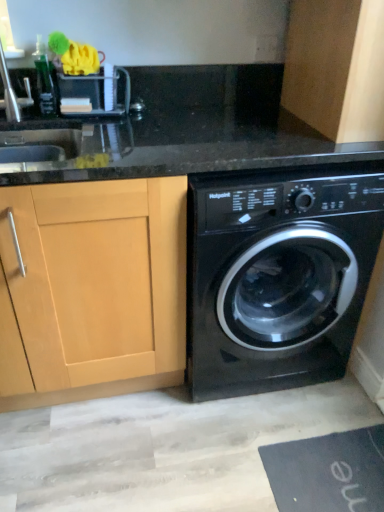
Question: Is black rubber bath mat at lower right placed right next to light wood cabinet at left, positioned as the 1th cabinetry in left-to-right order?

Choices:
 (A) yes
 (B) no

Answer: (B)

Question: Is black rubber bath mat at lower right bigger than light wood cabinet at left, the first cabinetry when ordered from bottom to top?

Choices:
 (A) no
 (B) yes

Answer: (A)

Question: Is the position of black rubber bath mat at lower right less distant than that of light wood cabinet at left, the second cabinetry in the right-to-left sequence?

Choices:
 (A) no
 (B) yes

Answer: (A)

Question: Is black rubber bath mat at lower right wider than light wood cabinet at left, the first cabinetry when ordered from bottom to top?

Choices:
 (A) no
 (B) yes

Answer: (A)

Question: Is black rubber bath mat at lower right further to camera compared to light wood cabinet at left, which appears as the 2th cabinetry when viewed from the top?

Choices:
 (A) no
 (B) yes

Answer: (B)

Question: Choose the correct answer: Is wooden cabinet at upper right, marked as the 2th cabinetry in a bottom-to-top arrangement, inside light wood cabinet at left, positioned as the 1th cabinetry in left-to-right order, or outside it?

Choices:
 (A) outside
 (B) inside

Answer: (A)

Question: In the image, is wooden cabinet at upper right, positioned as the first cabinetry in right-to-left order, on the left side or the right side of light wood cabinet at left, the first cabinetry when ordered from bottom to top?

Choices:
 (A) right
 (B) left

Answer: (A)

Question: From a real-world perspective, is wooden cabinet at upper right, acting as the first cabinetry starting from the top, positioned above or below light wood cabinet at left, positioned as the 1th cabinetry in left-to-right order?

Choices:
 (A) below
 (B) above

Answer: (B)

Question: From the image's perspective, relative to light wood cabinet at left, which appears as the 2th cabinetry when viewed from the top, is wooden cabinet at upper right, acting as the first cabinetry starting from the top, above or below?

Choices:
 (A) below
 (B) above

Answer: (B)

Question: From a real-world perspective, is light wood cabinet at left, which appears as the 2th cabinetry when viewed from the top, physically located above or below black glossy washing machine at lower right?

Choices:
 (A) above
 (B) below

Answer: (B)

Question: Would you say light wood cabinet at left, which appears as the 2th cabinetry when viewed from the top, is inside or outside black glossy washing machine at lower right?

Choices:
 (A) outside
 (B) inside

Answer: (A)

Question: Considering the positions of point (139, 300) and point (316, 249), is point (139, 300) closer or farther from the camera than point (316, 249)?

Choices:
 (A) farther
 (B) closer

Answer: (B)

Question: Based on their positions, is light wood cabinet at left, the first cabinetry when ordered from bottom to top, located to the left or right of black glossy washing machine at lower right?

Choices:
 (A) left
 (B) right

Answer: (A)

Question: From the image's perspective, is black rubber bath mat at lower right located above or below black glossy washing machine at lower right?

Choices:
 (A) above
 (B) below

Answer: (B)

Question: In the image, is black rubber bath mat at lower right on the left side or the right side of black glossy washing machine at lower right?

Choices:
 (A) left
 (B) right

Answer: (B)